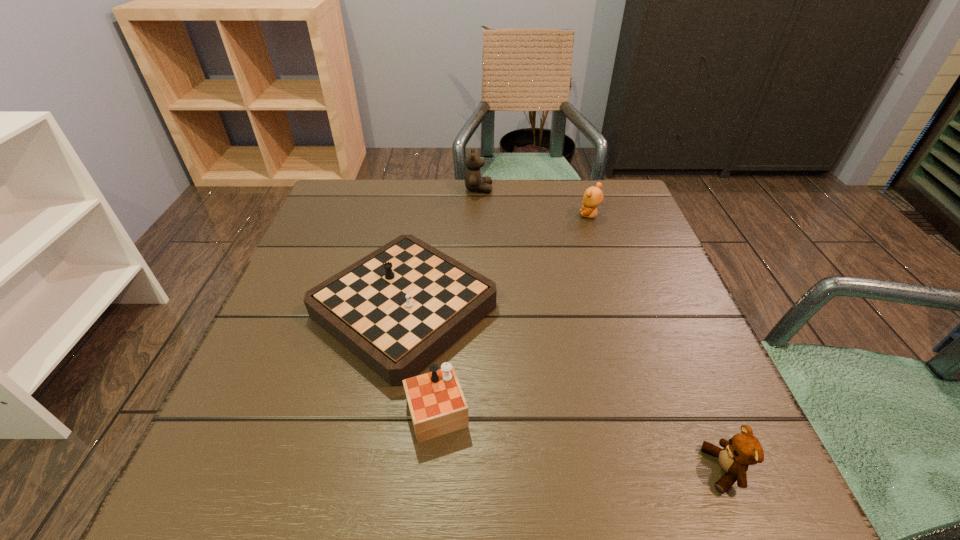
Where is `vacant space at the near edge of the desktop`? This screenshot has height=540, width=960. vacant space at the near edge of the desktop is located at coordinates (462, 489).

Locate an element on the screen. The width and height of the screenshot is (960, 540). free space at the left edge of the desktop is located at coordinates (300, 319).

You are a GUI agent. You are given a task and a screenshot of the screen. Output one action in this format:
    pyautogui.click(x=<x>, y=<y>)
    Task: Click on the free space at the right edge of the desktop
    
    Given the screenshot: What is the action you would take?
    pyautogui.click(x=593, y=250)

Find the location of `vacant space at the far left corner of the desktop`. vacant space at the far left corner of the desktop is located at coordinates (356, 185).

In the image, there is a desktop. Find the location of `free space at the near left corner`. free space at the near left corner is located at coordinates (247, 492).

Where is `vacant space at the far right corner`? The width and height of the screenshot is (960, 540). vacant space at the far right corner is located at coordinates (612, 194).

What are the coordinates of `empty space that is in between the second nearest teddy bear and the rightmost teddy bear` in the screenshot? It's located at (657, 342).

Locate an element on the screen. The image size is (960, 540). free point between the third farthest object and the nearest object is located at coordinates (563, 399).

This screenshot has width=960, height=540. What are the coordinates of `free point between the chessboard and the rightmost object` in the screenshot? It's located at (563, 399).

At what (x,y) coordinates should I click in order to perform the action: click on free spot between the tallest object and the second object from right to left. Please return your answer as a coordinate pair (x, y). Image resolution: width=960 pixels, height=540 pixels. Looking at the image, I should click on (534, 202).